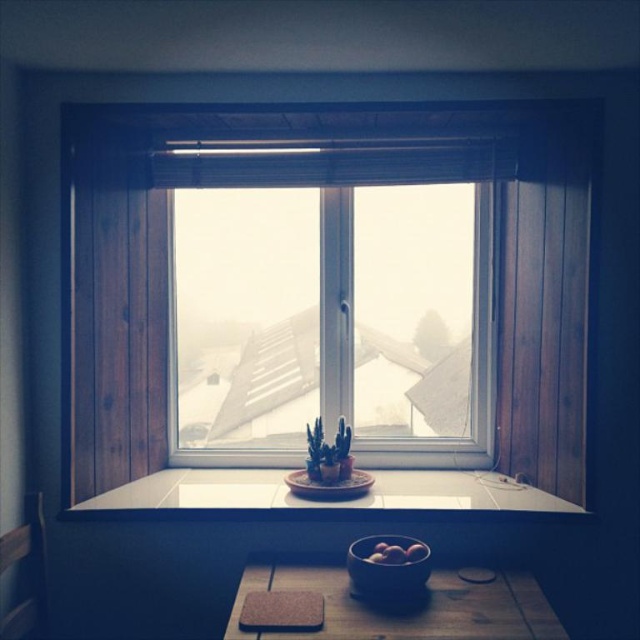
Question: Does transparent glass window at center have a lesser width compared to wooden table at center?

Choices:
 (A) yes
 (B) no

Answer: (B)

Question: From the image, what is the correct spatial relationship of clear glass window at center in relation to wooden table at center?

Choices:
 (A) above
 (B) below

Answer: (A)

Question: Which of the following is the closest to the observer?

Choices:
 (A) (152, 484)
 (B) (365, 564)
 (C) (324, 584)

Answer: (B)

Question: Which object is closer to the camera taking this photo?

Choices:
 (A) white tile at center
 (B) wooden table at center
 (C) matte black bowl at lower center
 (D) clear glass window at center

Answer: (B)

Question: In this image, where is wooden table at center located relative to glossy apple at center?

Choices:
 (A) left
 (B) right

Answer: (A)

Question: Based on their relative distances, which object is farther from the white tile at center?

Choices:
 (A) matte black bowl at lower center
 (B) wooden table at center

Answer: (A)